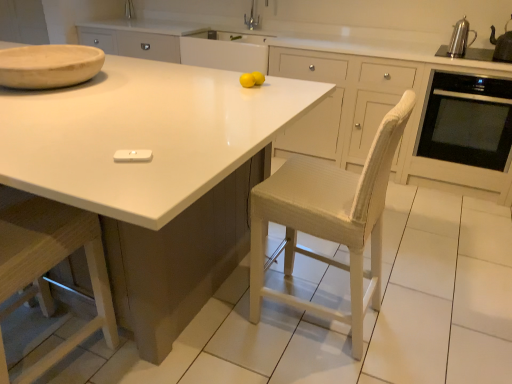
Question: Is silver metallic faucet at upper center at the right side of metallic silver kettle at upper right, which is the 2th appliance in left-to-right order?

Choices:
 (A) no
 (B) yes

Answer: (A)

Question: Is the surface of silver metallic faucet at upper center in direct contact with metallic silver kettle at upper right, which is the 1th appliance in top-to-bottom order?

Choices:
 (A) no
 (B) yes

Answer: (A)

Question: From the image's perspective, is silver metallic faucet at upper center located above metallic silver kettle at upper right, arranged as the second appliance when ordered from the bottom?

Choices:
 (A) yes
 (B) no

Answer: (A)

Question: Is the position of silver metallic faucet at upper center more distant than that of metallic silver kettle at upper right, which is the 1th appliance in top-to-bottom order?

Choices:
 (A) no
 (B) yes

Answer: (B)

Question: Would you say silver metallic faucet at upper center is outside metallic silver kettle at upper right, arranged as the second appliance when ordered from the bottom?

Choices:
 (A) no
 (B) yes

Answer: (B)

Question: Visually, is metallic silver kettle at upper right, arranged as the second appliance when ordered from the bottom, positioned to the left or to the right of silver metallic faucet at upper center?

Choices:
 (A) right
 (B) left

Answer: (A)

Question: From a real-world perspective, is metallic silver kettle at upper right, which is the 1th appliance in top-to-bottom order, above or below silver metallic faucet at upper center?

Choices:
 (A) above
 (B) below

Answer: (B)

Question: Considering their positions, is metallic silver kettle at upper right, the 2th appliance from the front, located in front of or behind silver metallic faucet at upper center?

Choices:
 (A) front
 (B) behind

Answer: (A)

Question: From the image's perspective, is metallic silver kettle at upper right, positioned as the 1th appliance in right-to-left order, located above or below silver metallic faucet at upper center?

Choices:
 (A) above
 (B) below

Answer: (B)

Question: Would you say wooden at left is inside or outside white glossy countertop at center?

Choices:
 (A) outside
 (B) inside

Answer: (B)

Question: From the image's perspective, relative to white glossy countertop at center, is wooden at left above or below?

Choices:
 (A) above
 (B) below

Answer: (B)

Question: Is wooden at left taller or shorter than white glossy countertop at center?

Choices:
 (A) short
 (B) tall

Answer: (B)

Question: Considering the positions of wooden at left and white glossy countertop at center in the image, is wooden at left wider or thinner than white glossy countertop at center?

Choices:
 (A) wide
 (B) thin

Answer: (B)

Question: From a real-world perspective, relative to black glass oven at right, is silver metallic faucet at upper center vertically above or below?

Choices:
 (A) below
 (B) above

Answer: (B)

Question: Is point coord(245,24) closer or farther from the camera than point coord(477,139)?

Choices:
 (A) farther
 (B) closer

Answer: (A)